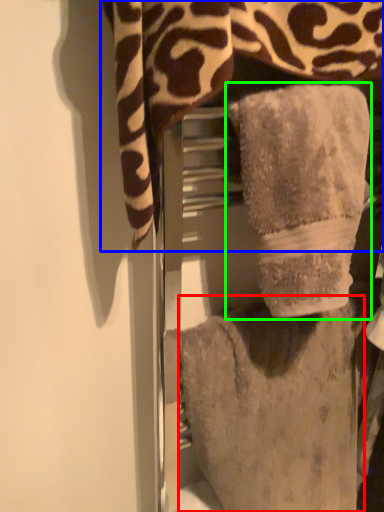
Question: Estimate the real-world distances between objects in this image. Which object is farther from towel (highlighted by a red box), towel (highlighted by a blue box) or towel (highlighted by a green box)?

Choices:
 (A) towel
 (B) towel

Answer: (A)